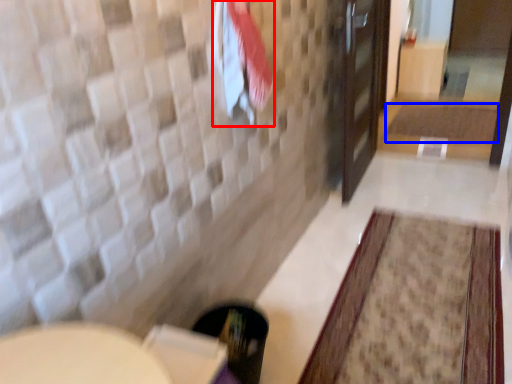
Question: Among these objects, which one is nearest to the camera, beach towel (highlighted by a red box) or bath mat (highlighted by a blue box)?

Choices:
 (A) beach towel
 (B) bath mat

Answer: (A)